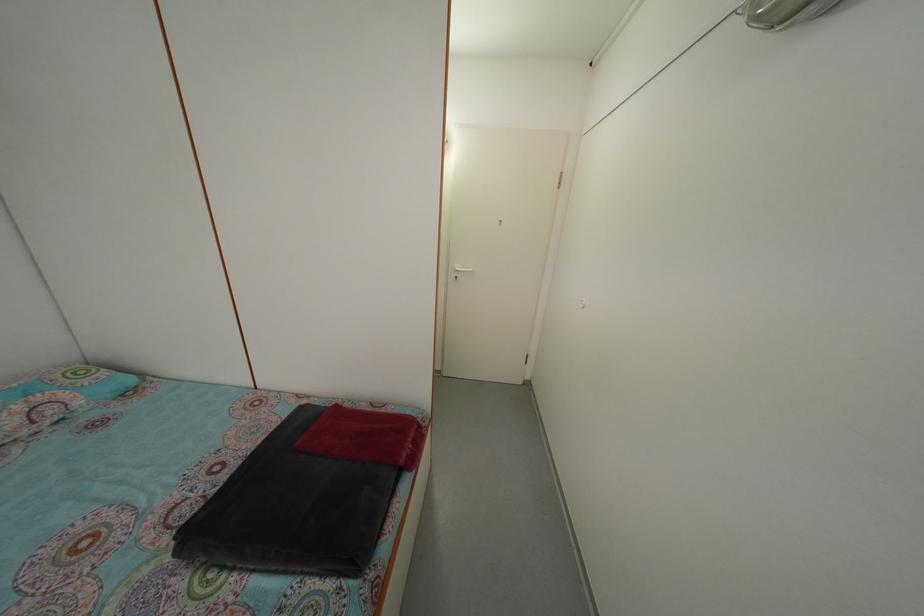
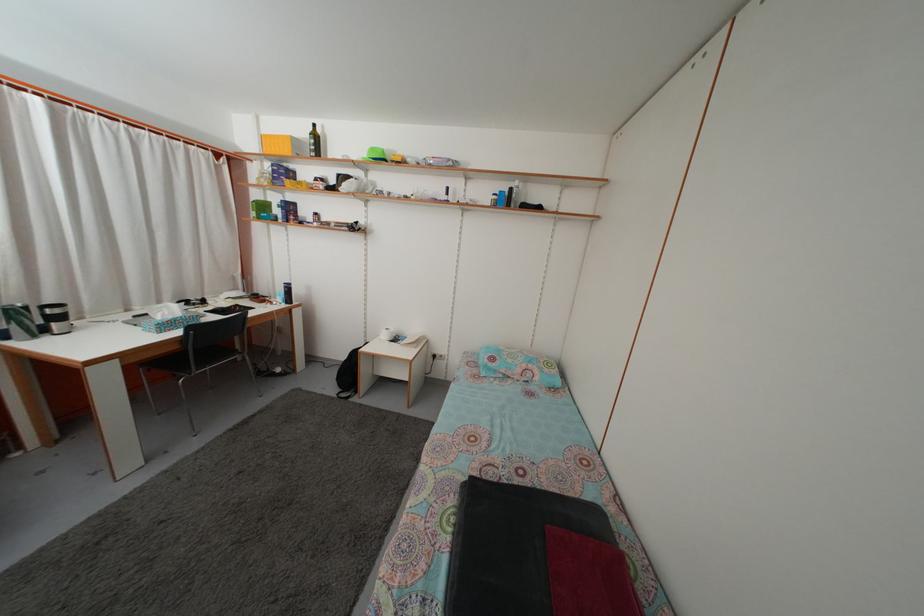
Question: The camera is either moving clockwise (left) or counter-clockwise (right) around the object. The first image is from the beginning of the video and the second image is from the end. Is the camera moving left or right when shooting the video?

Choices:
 (A) Left
 (B) Right

Answer: (B)